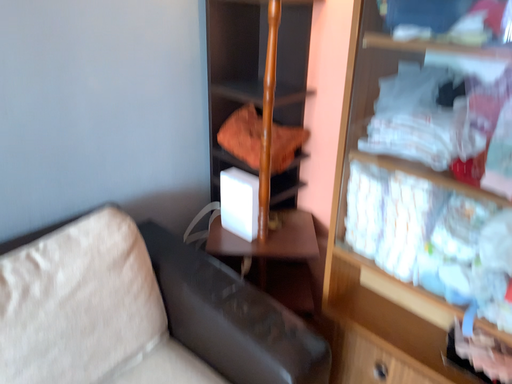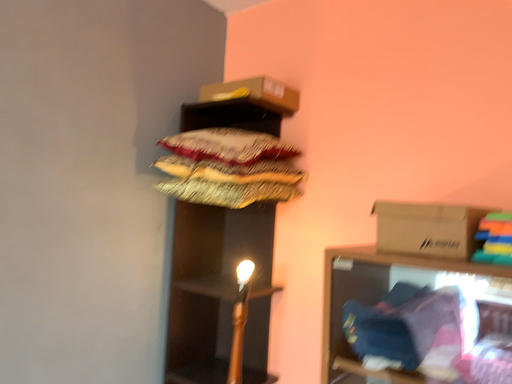
Question: How did the camera likely rotate when shooting the video?

Choices:
 (A) rotated right
 (B) rotated left

Answer: (A)